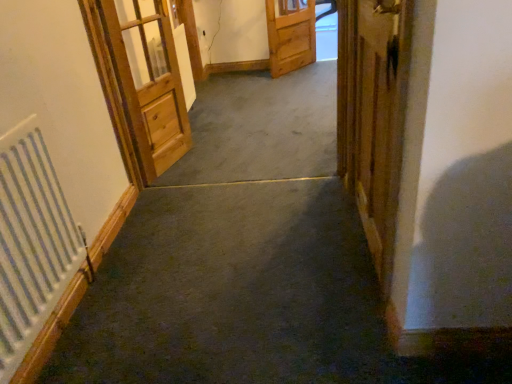
Question: Based on their sizes in the image, would you say light brown wooden door at left, which ranks as the 3th door in right-to-left order, is bigger or smaller than wooden door at right, the third door in the left-to-right sequence?

Choices:
 (A) small
 (B) big

Answer: (B)

Question: Do you think light brown wooden door at left, the 1th door viewed from the left, is within wooden door at right, the third door in the left-to-right sequence, or outside of it?

Choices:
 (A) inside
 (B) outside

Answer: (B)

Question: Estimate the real-world distances between objects in this image. Which object is closer to the wooden drawer at center?

Choices:
 (A) wooden door at center, marked as the 3th door in a front-to-back arrangement
 (B) wooden door at right, acting as the 1th door starting from the right
 (C) light brown wooden door at left, marked as the second door in a back-to-front arrangement
 (D) white metallic radiator at left

Answer: (A)

Question: Which object is the closest to the wooden door at right, placed as the first door when sorted from front to back?

Choices:
 (A) light brown wooden door at left, marked as the second door in a back-to-front arrangement
 (B) wooden door at center, marked as the 3th door in a front-to-back arrangement
 (C) white metallic radiator at left
 (D) wooden drawer at center

Answer: (A)